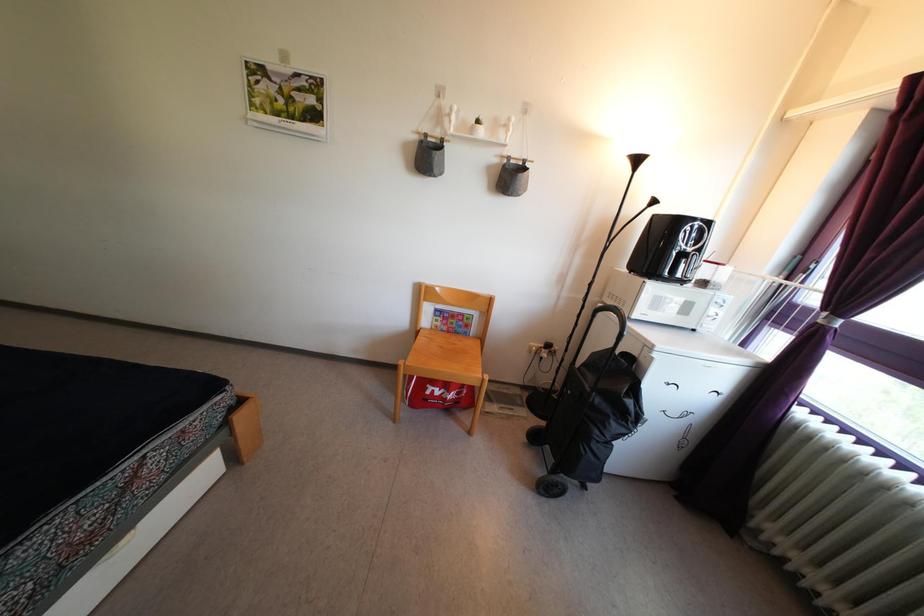
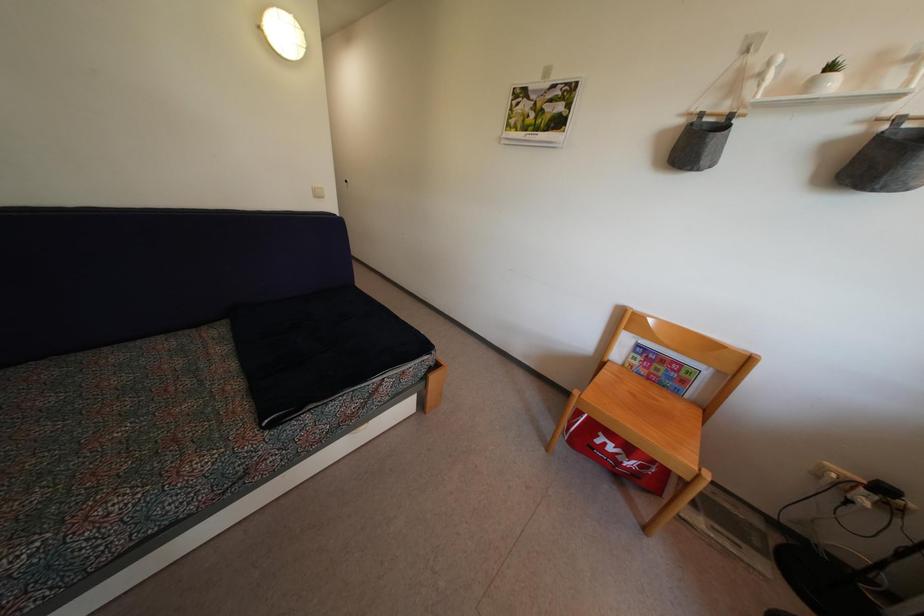
In the second image, find the point that corresponds to (x=480, y=130) in the first image.

(833, 76)